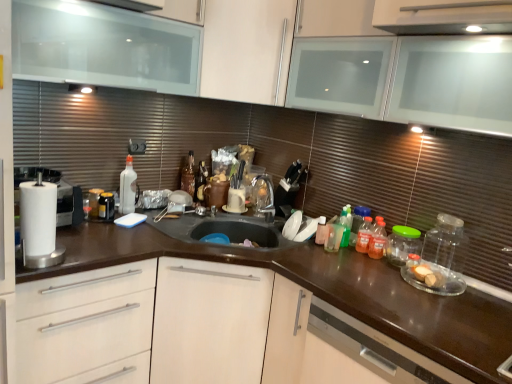
Question: Is white matte drawer at lower left a part of satin brown dishwasher at lower right?

Choices:
 (A) yes
 (B) no

Answer: (B)

Question: From the image's perspective, would you say satin brown dishwasher at lower right is shown under white matte drawer at lower left?

Choices:
 (A) no
 (B) yes

Answer: (B)

Question: Considering the relative sizes of satin brown dishwasher at lower right and white matte drawer at lower left in the image provided, is satin brown dishwasher at lower right bigger than white matte drawer at lower left?

Choices:
 (A) yes
 (B) no

Answer: (B)

Question: Can you confirm if satin brown dishwasher at lower right is shorter than white matte drawer at lower left?

Choices:
 (A) yes
 (B) no

Answer: (A)

Question: Could you tell me if satin brown dishwasher at lower right is turned towards white matte drawer at lower left?

Choices:
 (A) no
 (B) yes

Answer: (A)

Question: Based on their sizes in the image, would you say transparent glass cabinet at upper left, acting as the first cabinetry starting from the left, is bigger or smaller than white matte cabinet at upper center, the 1th cabinetry in the right-to-left sequence?

Choices:
 (A) small
 (B) big

Answer: (B)

Question: From the image's perspective, relative to white matte cabinet at upper center, the 2th cabinetry when ordered from left to right, is transparent glass cabinet at upper left, the 2th cabinetry when ordered from right to left, above or below?

Choices:
 (A) above
 (B) below

Answer: (B)

Question: From a real-world perspective, is transparent glass cabinet at upper left, the 2th cabinetry when ordered from right to left, physically located above or below white matte cabinet at upper center, the 2th cabinetry when ordered from left to right?

Choices:
 (A) above
 (B) below

Answer: (B)

Question: Is point coord(179,76) positioned closer to the camera than point coord(243,51)?

Choices:
 (A) closer
 (B) farther

Answer: (A)

Question: From the image's perspective, is white matte cabinet at upper center, the 1th cabinetry in the right-to-left sequence, positioned above or below satin brown dishwasher at lower right?

Choices:
 (A) above
 (B) below

Answer: (A)

Question: Is white matte cabinet at upper center, the 1th cabinetry in the right-to-left sequence, to the left or to the right of satin brown dishwasher at lower right in the image?

Choices:
 (A) left
 (B) right

Answer: (A)

Question: From a real-world perspective, relative to satin brown dishwasher at lower right, is white matte cabinet at upper center, the 2th cabinetry when ordered from left to right, vertically above or below?

Choices:
 (A) above
 (B) below

Answer: (A)

Question: Relative to satin brown dishwasher at lower right, is white matte cabinet at upper center, the 1th cabinetry in the right-to-left sequence, in front or behind?

Choices:
 (A) front
 (B) behind

Answer: (B)

Question: From the image's perspective, is white glossy mug at center positioned above or below satin brown dishwasher at lower right?

Choices:
 (A) above
 (B) below

Answer: (A)

Question: In the image, is white glossy mug at center on the left side or the right side of satin brown dishwasher at lower right?

Choices:
 (A) left
 (B) right

Answer: (A)